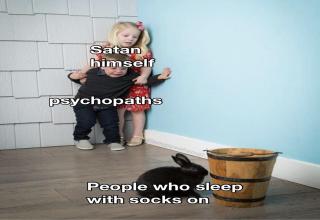
You are a GUI agent. You are given a task and a screenshot of the screen. Output one action in this format:
    pyautogui.click(x=<x>, y=<y>)
    Task: Click on the wall
    
    Given the screenshot: What is the action you would take?
    pyautogui.click(x=47, y=26)